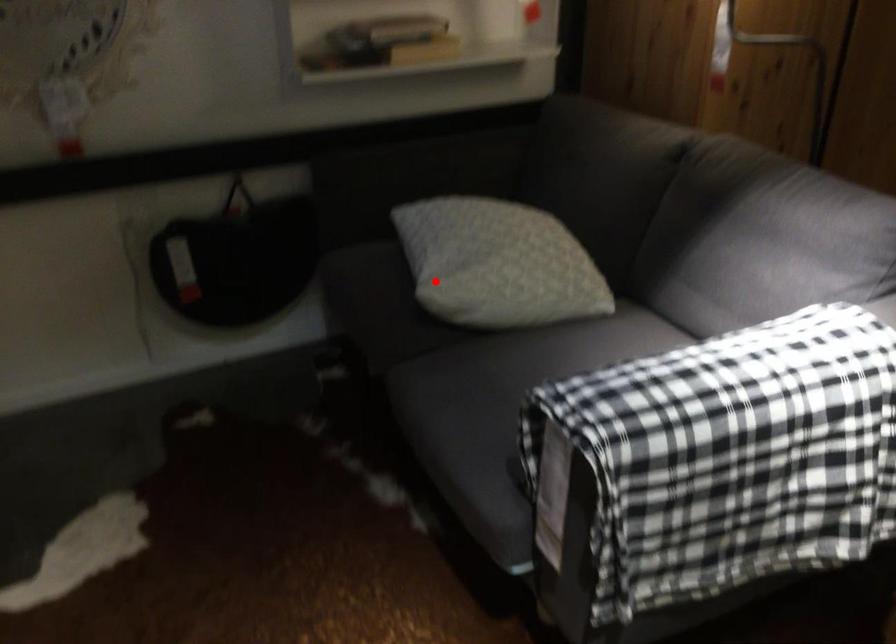
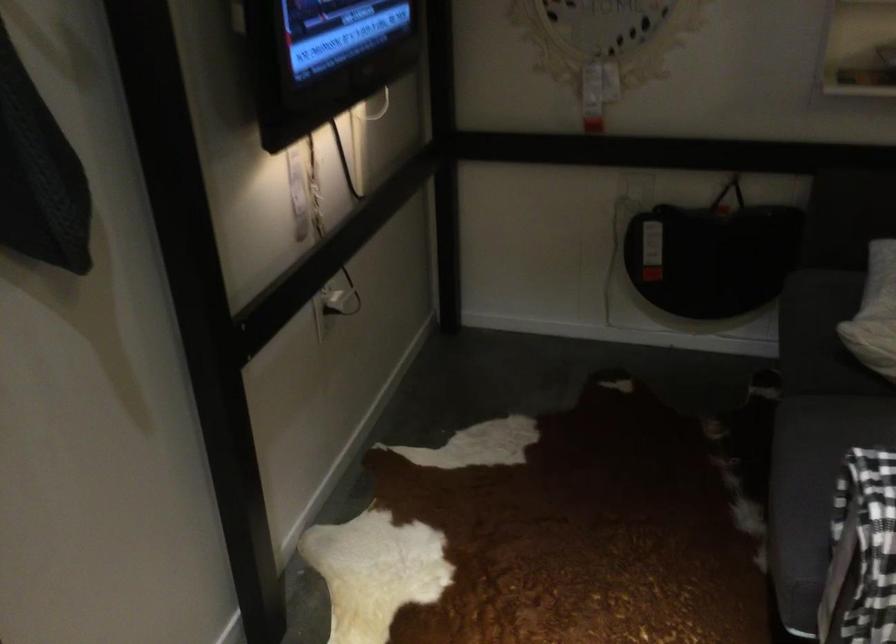
The point at the highlighted location is marked in the first image. Where is the corresponding point in the second image?

(874, 313)